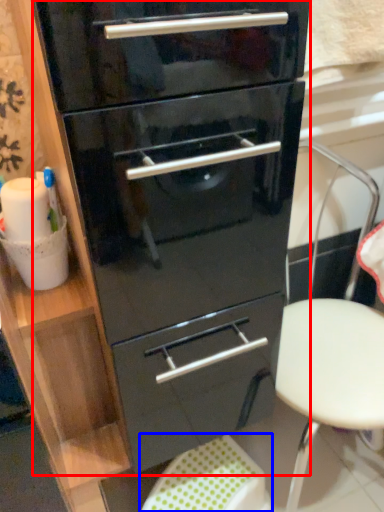
Question: Which object is further to the camera taking this photo, chest of drawers (highlighted by a red box) or step stool (highlighted by a blue box)?

Choices:
 (A) chest of drawers
 (B) step stool

Answer: (B)